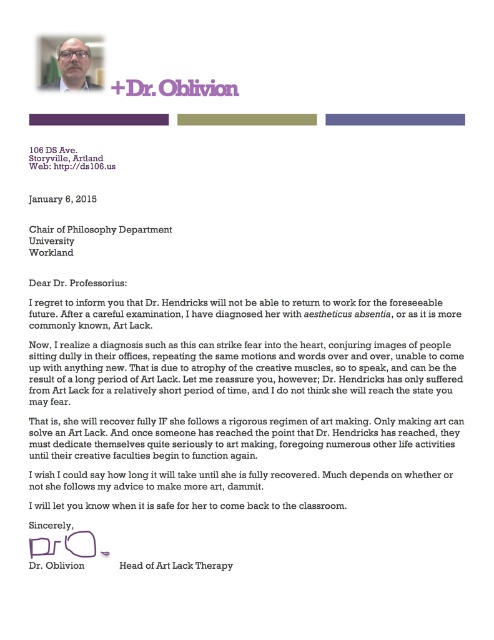
Based on the provided scene description, can you determine the exact coordinates of the matte black glasses at upper center?

The position of matte black glasses at upper center is at point [72,67].

You are a student trying to read the letter written on the white paper at upper center. There are matte black glasses at upper center in the way. Can you move the glasses to access the text?

The matte black glasses at upper center is closer to the viewer than the white paper at upper center, so you can move the glasses to access the text on the white paper at upper center.

Based on the provided scene description, what is the significance of the point at coordinates (76, 234)?

The point at coordinates (76, 234) indicates the location of the black paper at center.